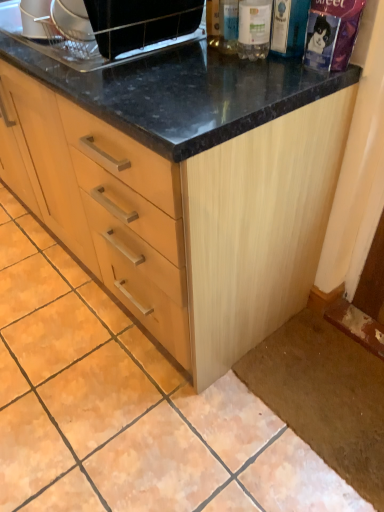
At what (x,y) coordinates should I click in order to perform the action: click on vacant region in front of transparent plastic bottle at upper right, which is counted as the 1th bottle, starting from the right. Please return your answer as a coordinate pair (x, y). This screenshot has height=512, width=384. Looking at the image, I should click on (283, 75).